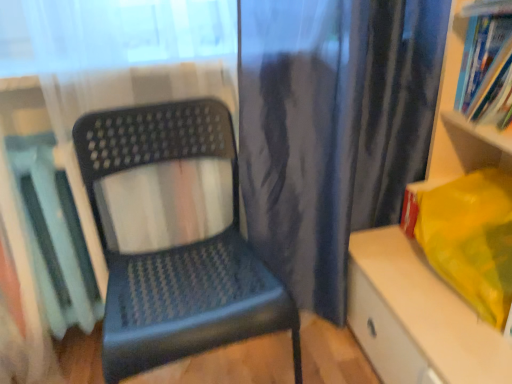
The image size is (512, 384). What are the coordinates of `matte plastic chair at center` in the screenshot? It's located at (177, 248).

Identify the location of matte plastic shelf at right, the 1th shelf from the bottom. [417, 317].

Describe the element at coordinates (484, 64) in the screenshot. Image resolution: width=512 pixels, height=384 pixels. I see `blue paperback book at upper right, the second book from the bottom` at that location.

In order to click on blue paperback book at upper right, which is counted as the 1th book, starting from the right in this screenshot , I will do `click(484, 64)`.

You are a GUI agent. You are given a task and a screenshot of the screen. Output one action in this format:
    pyautogui.click(x=<x>, y=<y>)
    Task: Click on the matte plastic book at left, positioned as the 2th book in right-to-left order
    The height and width of the screenshot is (384, 512).
    Given the screenshot: What is the action you would take?
    pyautogui.click(x=55, y=234)

From a real-world perspective, is matte plastic books at upper right, the first shelf in the top-to-bottom sequence, positioned over matte plastic chair at center based on gravity?

Yes, from a real-world perspective, matte plastic books at upper right, the first shelf in the top-to-bottom sequence, is on top of matte plastic chair at center.

Is matte plastic books at upper right, the second shelf positioned from the bottom, directly adjacent to matte plastic chair at center?

No, matte plastic books at upper right, the second shelf positioned from the bottom, is not touching matte plastic chair at center.

Is point (460, 49) positioned in front of point (231, 247)?

That is True.

Is matte plastic book at left, the 1th book positioned from the bottom, taller than matte plastic books at upper right, the second shelf positioned from the bottom?

Correct, matte plastic book at left, the 1th book positioned from the bottom, is much taller as matte plastic books at upper right, the second shelf positioned from the bottom.

Which is less distant, (61, 272) or (462, 118)?

The point (462, 118) is closer to the camera.

Is matte plastic books at upper right, the second shelf positioned from the bottom, at the back of matte plastic book at left, positioned as the 2th book in right-to-left order?

matte plastic book at left, positioned as the 2th book in right-to-left order, is not turned away from matte plastic books at upper right, the second shelf positioned from the bottom.

Is matte plastic books at upper right, the first shelf in the top-to-bottom sequence, beside blue paperback book at upper right, the second book from the bottom?

Yes, matte plastic books at upper right, the first shelf in the top-to-bottom sequence, is touching blue paperback book at upper right, the second book from the bottom.

Which object is closer to the camera, matte plastic books at upper right, the first shelf in the top-to-bottom sequence, or blue paperback book at upper right, which appears as the second book when viewed from the left?

matte plastic books at upper right, the first shelf in the top-to-bottom sequence, is more forward.

From a real-world perspective, between matte plastic books at upper right, the second shelf positioned from the bottom, and blue paperback book at upper right, which is counted as the 1th book, starting from the right, who is vertically lower?

blue paperback book at upper right, which is counted as the 1th book, starting from the right, is physically lower.

Considering the sizes of objects matte plastic books at upper right, the second shelf positioned from the bottom, and blue paperback book at upper right, which is counted as the 1th book, starting from the top, in the image provided, who is wider, matte plastic books at upper right, the second shelf positioned from the bottom, or blue paperback book at upper right, which is counted as the 1th book, starting from the top,?

matte plastic books at upper right, the second shelf positioned from the bottom, is wider.

This screenshot has width=512, height=384. What are the coordinates of `chair in front of the blue paperback book at upper right, the second book from the bottom` in the screenshot? It's located at (177, 248).

Could you tell me if blue paperback book at upper right, which is counted as the 1th book, starting from the top, is facing matte plastic chair at center?

Yes.

Is blue paperback book at upper right, which is counted as the 1th book, starting from the top, wider or thinner than matte plastic chair at center?

In the image, blue paperback book at upper right, which is counted as the 1th book, starting from the top, appears to be more narrow than matte plastic chair at center.

Are blue paperback book at upper right, the second book from the bottom, and matte plastic chair at center far apart?

Actually, blue paperback book at upper right, the second book from the bottom, and matte plastic chair at center are a little close together.

Does point (470, 73) come farther from viewer compared to point (49, 219)?

No.

From the image's perspective, is blue paperback book at upper right, the second book from the bottom, above or below matte plastic book at left, which is the second book in top-to-bottom order?

Based on their image positions, blue paperback book at upper right, the second book from the bottom, is located above matte plastic book at left, which is the second book in top-to-bottom order.

Does blue paperback book at upper right, which is counted as the 1th book, starting from the top, come behind matte plastic book at left, which is the second book in top-to-bottom order?

Yes, it is.

Choose the correct answer: Is blue paperback book at upper right, which is counted as the 1th book, starting from the top, inside matte plastic book at left, positioned as the 2th book in right-to-left order, or outside it?

blue paperback book at upper right, which is counted as the 1th book, starting from the top, is outside matte plastic book at left, positioned as the 2th book in right-to-left order.

Can you confirm if matte plastic shelf at right, the 1th shelf from the bottom, is positioned to the right of blue paperback book at upper right, which is counted as the 1th book, starting from the top?

No.

From the image's perspective, is matte plastic shelf at right, the 1th shelf from the bottom, beneath blue paperback book at upper right, which is counted as the 1th book, starting from the top?

Correct, matte plastic shelf at right, the 1th shelf from the bottom, appears lower than blue paperback book at upper right, which is counted as the 1th book, starting from the top, in the image.

Based on the photo, does matte plastic shelf at right, the 1th shelf from the bottom, turn towards blue paperback book at upper right, which appears as the second book when viewed from the left?

No.

Is the surface of matte plastic chair at center in direct contact with matte plastic book at left, which is the second book in top-to-bottom order?

No.

Considering the relative sizes of matte plastic chair at center and matte plastic book at left, the 1th book positioned from the bottom, in the image provided, is matte plastic chair at center wider than matte plastic book at left, the 1th book positioned from the bottom,?

Yes.

Considering the sizes of objects matte plastic chair at center and matte plastic book at left, which is the second book in top-to-bottom order, in the image provided, who is shorter, matte plastic chair at center or matte plastic book at left, which is the second book in top-to-bottom order,?

Standing shorter between the two is matte plastic book at left, which is the second book in top-to-bottom order.

Does matte plastic chair at center contain matte plastic book at left, the 1th book positioned from the bottom?

No, matte plastic book at left, the 1th book positioned from the bottom, is located outside of matte plastic chair at center.

You are a GUI agent. You are given a task and a screenshot of the screen. Output one action in this format:
    pyautogui.click(x=<x>, y=<y>)
    Task: Click on the chair in front of the matte plastic books at upper right, the first shelf in the top-to-bottom sequence
    The image size is (512, 384).
    Given the screenshot: What is the action you would take?
    pyautogui.click(x=177, y=248)

From a real-world perspective, starting from the matte plastic book at left, which is the second book in top-to-bottom order, which shelf is the 2nd one vertically above it? Please provide its 2D coordinates.

[(459, 117)]

Estimate the real-world distances between objects in this image. Which object is closer to blue paperback book at upper right, the second book from the bottom, matte plastic books at upper right, the first shelf in the top-to-bottom sequence, or matte plastic book at left, the 1th book positioned from the bottom?

matte plastic books at upper right, the first shelf in the top-to-bottom sequence, is positioned closer to the anchor blue paperback book at upper right, the second book from the bottom.

When comparing their distances from matte plastic book at left, the 1th book positioned from the bottom, does matte plastic books at upper right, the first shelf in the top-to-bottom sequence, or matte plastic chair at center seem further?

matte plastic books at upper right, the first shelf in the top-to-bottom sequence, is positioned further to the anchor matte plastic book at left, the 1th book positioned from the bottom.

Looking at the image, which one is located closer to matte plastic book at left, positioned as the 2th book in right-to-left order, blue paperback book at upper right, which appears as the second book when viewed from the left, or matte plastic chair at center?

Based on the image, matte plastic chair at center appears to be nearer to matte plastic book at left, positioned as the 2th book in right-to-left order.

Based on their spatial positions, is blue paperback book at upper right, which appears as the second book when viewed from the left, or matte plastic shelf at right, the 1th shelf from the bottom, closer to matte plastic chair at center?

matte plastic shelf at right, the 1th shelf from the bottom, is positioned closer to the anchor matte plastic chair at center.

Which object lies further to the anchor point matte plastic shelf at right, the 1th shelf from the bottom, blue paperback book at upper right, which appears as the second book when viewed from the left, or matte plastic chair at center?

Based on the image, matte plastic chair at center appears to be further to matte plastic shelf at right, the 1th shelf from the bottom.

Looking at the image, which one is located further to matte plastic chair at center, matte plastic books at upper right, the first shelf in the top-to-bottom sequence, or matte plastic book at left, positioned as the 2th book in right-to-left order?

Among the two, matte plastic books at upper right, the first shelf in the top-to-bottom sequence, is located further to matte plastic chair at center.

Looking at the image, which one is located closer to blue paperback book at upper right, which appears as the second book when viewed from the left, matte plastic book at left, which is the second book in top-to-bottom order, or matte plastic books at upper right, the first shelf in the top-to-bottom sequence?

Based on the image, matte plastic books at upper right, the first shelf in the top-to-bottom sequence, appears to be nearer to blue paperback book at upper right, which appears as the second book when viewed from the left.

Looking at the image, which one is located further to matte plastic book at left, positioned as the 2th book in right-to-left order, blue paperback book at upper right, which appears as the second book when viewed from the left, or matte plastic shelf at right, arranged as the second shelf when viewed from the top?

Based on the image, blue paperback book at upper right, which appears as the second book when viewed from the left, appears to be further to matte plastic book at left, positioned as the 2th book in right-to-left order.

Identify the location of book situated between matte plastic chair at center and matte plastic books at upper right, the first shelf in the top-to-bottom sequence, from left to right. This screenshot has height=384, width=512. 484,64.

What are the coordinates of `chair situated between matte plastic book at left, which is the second book in top-to-bottom order, and matte plastic shelf at right, the 1th shelf from the bottom, from left to right` in the screenshot? It's located at (177, 248).

At what (x,y) coordinates should I click in order to perform the action: click on chair situated between matte plastic book at left, positioned as the 2th book in right-to-left order, and blue paperback book at upper right, which is counted as the 1th book, starting from the right, from left to right. Please return your answer as a coordinate pair (x, y). The image size is (512, 384). Looking at the image, I should click on (177, 248).

Identify the location of shelf located between matte plastic chair at center and matte plastic books at upper right, the second shelf positioned from the bottom, in the left-right direction. The height and width of the screenshot is (384, 512). (417, 317).